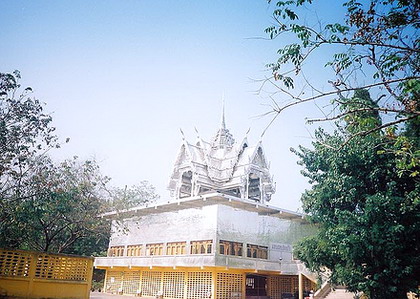
Identify the location of door. (256, 284).